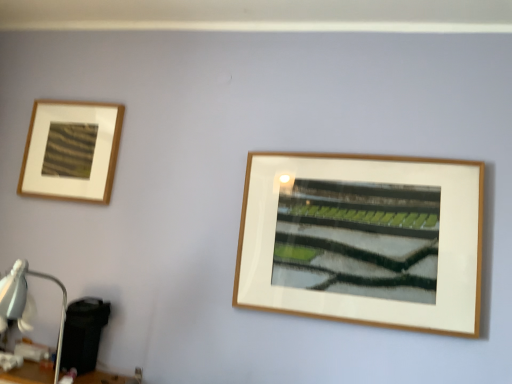
Question: Does point 57,147 appear closer or farther from the camera than point 0,291?

Choices:
 (A) closer
 (B) farther

Answer: (B)

Question: Is matte wood picture frame at upper left situated inside matte white table lamp at lower left or outside?

Choices:
 (A) inside
 (B) outside

Answer: (B)

Question: Which object is the farthest from the matte white table lamp at lower left?

Choices:
 (A) wooden table at lower left
 (B) matte wood picture frame at upper left

Answer: (B)

Question: Which is farther from the matte wood picture frame at upper left?

Choices:
 (A) matte white table lamp at lower left
 (B) wooden table at lower left

Answer: (B)